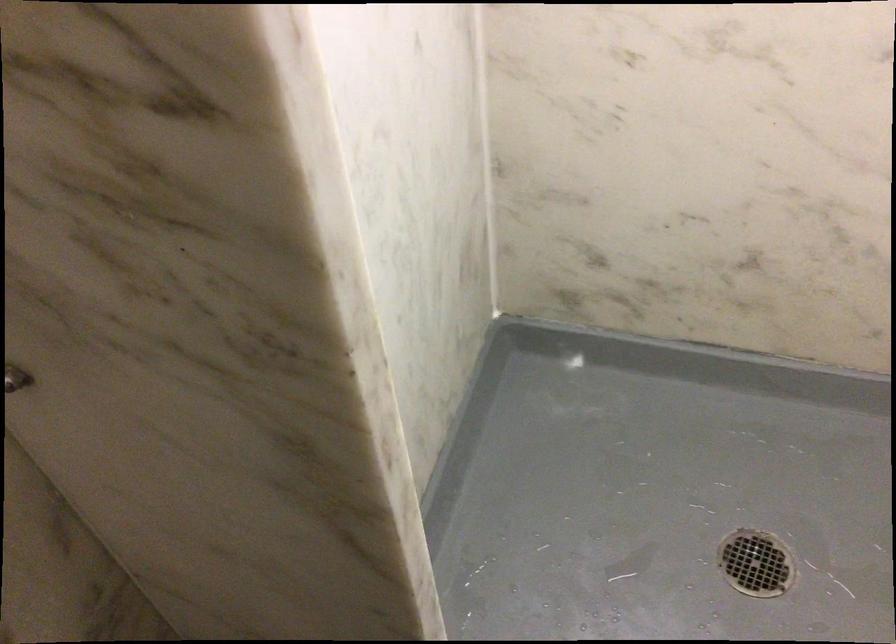
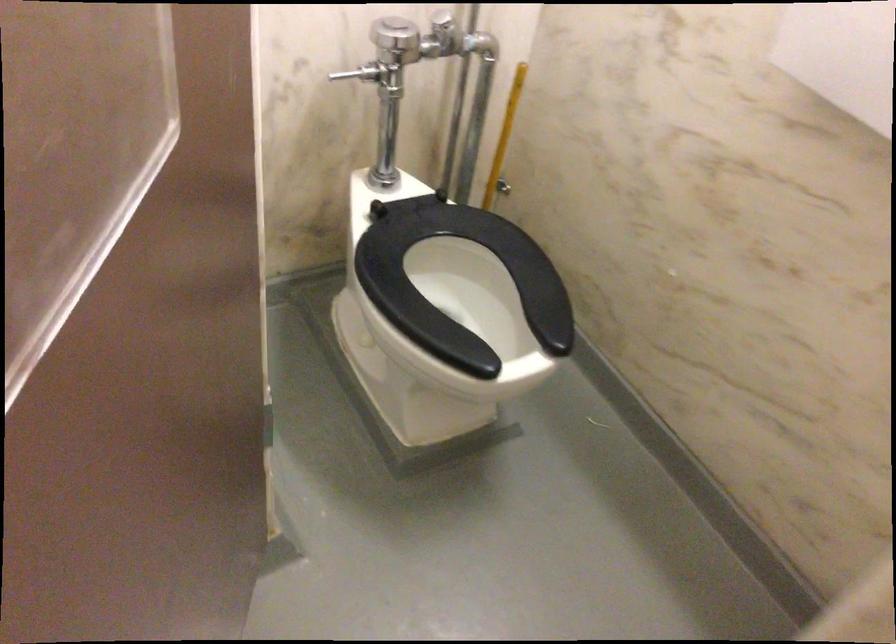
Question: The camera is either moving clockwise (left) or counter-clockwise (right) around the object. The first image is from the beginning of the video and the second image is from the end. Is the camera moving left or right when shooting the video?

Choices:
 (A) Left
 (B) Right

Answer: (A)